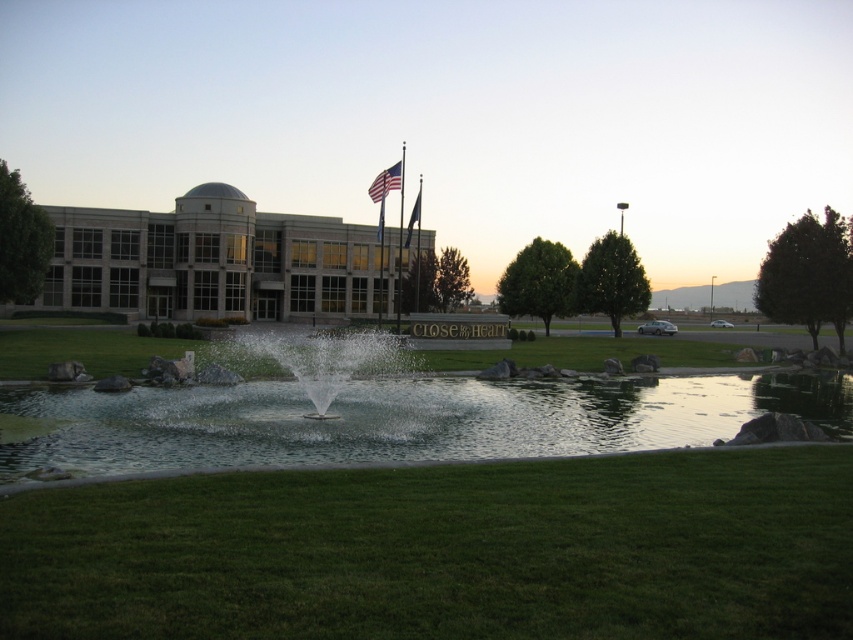
Is green grass at center to the left of clear water at center from the viewer's perspective?

In fact, green grass at center is to the right of clear water at center.

Is point (97, 540) closer to viewer compared to point (474, 396)?

Yes.

The image size is (853, 640). Describe the element at coordinates (444, 552) in the screenshot. I see `green grass at center` at that location.

The width and height of the screenshot is (853, 640). I want to click on green grass at center, so click(x=444, y=552).

Is point (729, 515) in front of point (299, 364)?

Yes.

Can you confirm if green grass at center is bigger than clear water fountain at center?

No, green grass at center is not bigger than clear water fountain at center.

Who is more distant from viewer, (x=505, y=593) or (x=305, y=358)?

The point (x=305, y=358) is behind.

The image size is (853, 640). I want to click on green grass at center, so click(444, 552).

Does metallic flag pole at center have a smaller size compared to american flag at upper center?

Yes.

Is metallic flag pole at center further to camera compared to american flag at upper center?

No.

I want to click on metallic flag pole at center, so click(399, 237).

I want to click on metallic flag pole at center, so click(399, 237).